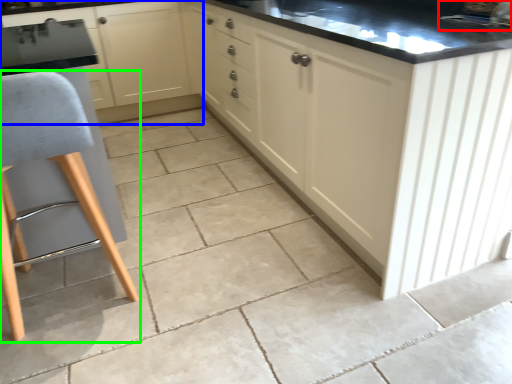
Question: Which object is the closest to the sink (highlighted by a red box)? Choose among these: cabinetry (highlighted by a blue box) or furniture (highlighted by a green box).

Choices:
 (A) cabinetry
 (B) furniture

Answer: (B)